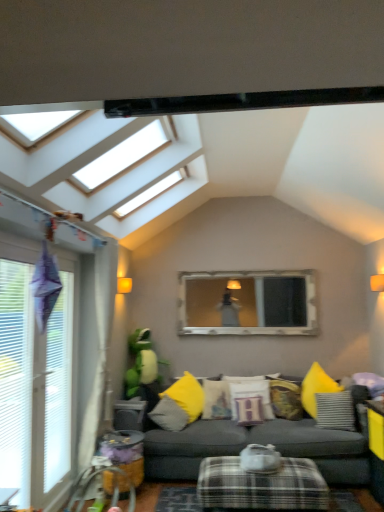
Question: Should I look upward or downward to see plaid fabric ottoman at lower center?

Choices:
 (A) down
 (B) up

Answer: (A)

Question: Should I look upward or downward to see matte yellow pillow at center, the fourth pillow in the right-to-left sequence?

Choices:
 (A) down
 (B) up

Answer: (A)

Question: Is plaid fabric ottoman at lower center to the left of white plastic window at left from the viewer's perspective?

Choices:
 (A) yes
 (B) no

Answer: (B)

Question: Can you confirm if plaid fabric ottoman at lower center is positioned to the right of white plastic window at left?

Choices:
 (A) no
 (B) yes

Answer: (B)

Question: Does plaid fabric ottoman at lower center have a lesser height compared to white plastic window at left?

Choices:
 (A) no
 (B) yes

Answer: (B)

Question: Is plaid fabric ottoman at lower center positioned far away from white plastic window at left?

Choices:
 (A) no
 (B) yes

Answer: (B)

Question: Is plaid fabric ottoman at lower center smaller than white plastic window at left?

Choices:
 (A) no
 (B) yes

Answer: (B)

Question: Is plaid fabric ottoman at lower center beside white plastic window at left?

Choices:
 (A) no
 (B) yes

Answer: (A)

Question: Is white cotton pillow at center, placed as the third pillow when sorted from left to right, thinner than plaid fabric ottoman at lower center?

Choices:
 (A) yes
 (B) no

Answer: (A)

Question: Is white cotton pillow at center, placed as the third pillow when sorted from right to left, positioned behind plaid fabric ottoman at lower center?

Choices:
 (A) yes
 (B) no

Answer: (A)

Question: Would you consider white cotton pillow at center, placed as the third pillow when sorted from left to right, to be distant from plaid fabric ottoman at lower center?

Choices:
 (A) yes
 (B) no

Answer: (B)

Question: Is plaid fabric ottoman at lower center inside white cotton pillow at center, placed as the third pillow when sorted from left to right?

Choices:
 (A) yes
 (B) no

Answer: (B)

Question: From a real-world perspective, is white cotton pillow at center, placed as the third pillow when sorted from left to right, located beneath plaid fabric ottoman at lower center?

Choices:
 (A) yes
 (B) no

Answer: (B)

Question: Is white cotton pillow at center, placed as the third pillow when sorted from left to right, at the right side of plaid fabric ottoman at lower center?

Choices:
 (A) yes
 (B) no

Answer: (A)

Question: From a real-world perspective, is yellow fabric pillow at center, which is counted as the first pillow, starting from the left, physically below matte yellow pillow at center, the second pillow in the left-to-right sequence?

Choices:
 (A) no
 (B) yes

Answer: (B)